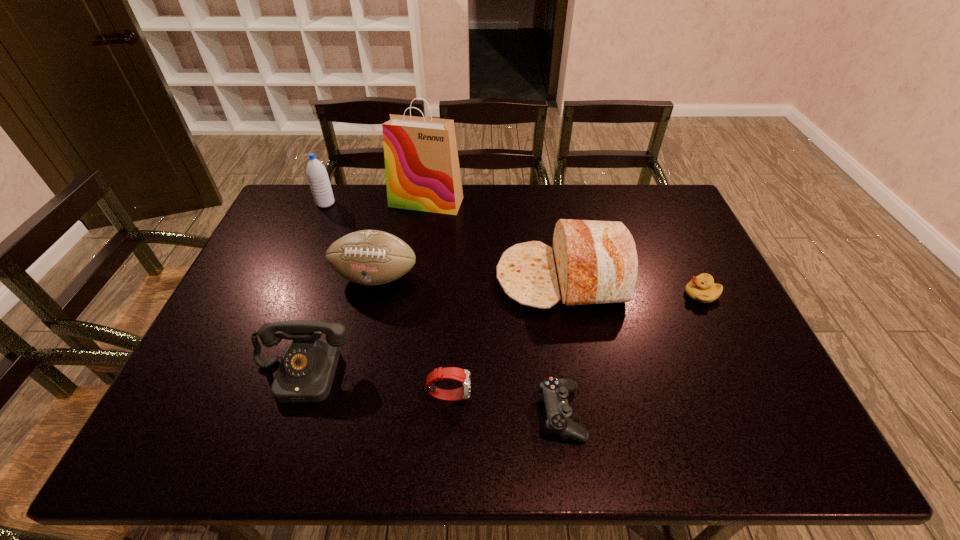
Where is `object that is the fourth closest to the shortest object`? The width and height of the screenshot is (960, 540). object that is the fourth closest to the shortest object is located at coordinates (x=702, y=288).

You are a GUI agent. You are given a task and a screenshot of the screen. Output one action in this format:
    pyautogui.click(x=<x>, y=<y>)
    Task: Click on the second closest object to the sixth tallest object
    This screenshot has height=540, width=960.
    Given the screenshot: What is the action you would take?
    pyautogui.click(x=305, y=375)

I want to click on free location that satisfies the following two spatial constraints: 1. on the dial of the shortest object; 2. on the right side of the telephone, so click(288, 413).

Where is `vacant region that satisfies the following two spatial constraints: 1. on the laces of the football (American); 2. on the right side of the shortest object`? Image resolution: width=960 pixels, height=540 pixels. vacant region that satisfies the following two spatial constraints: 1. on the laces of the football (American); 2. on the right side of the shortest object is located at coordinates (343, 413).

Locate an element on the screen. free space in the image that satisfies the following two spatial constraints: 1. on the face of the watch; 2. on the back side of the shortest object is located at coordinates (448, 413).